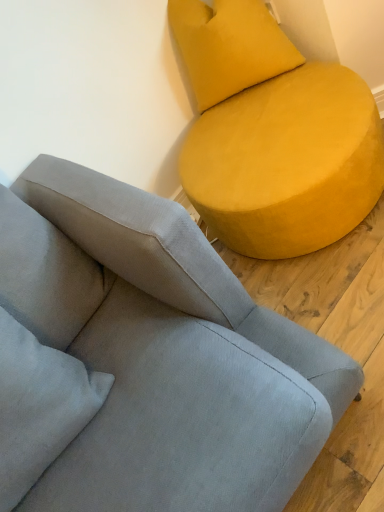
Question: Does point (379, 184) appear closer or farther from the camera than point (264, 30)?

Choices:
 (A) farther
 (B) closer

Answer: (B)

Question: In terms of size, does matte yellow ottoman at upper right, the 1th studio couch when ordered from right to left, appear bigger or smaller than velvet yellow pillow at upper right?

Choices:
 (A) small
 (B) big

Answer: (B)

Question: Estimate the real-world distances between objects in this image. Which object is closer to the matte yellow ottoman at upper right, acting as the 2th studio couch starting from the left?

Choices:
 (A) velvet yellow pillow at upper right
 (B) suede gray couch at upper right, which is counted as the 2th studio couch, starting from the right

Answer: (A)

Question: Considering the real-world distances, which object is closest to the matte yellow ottoman at upper right, acting as the 2th studio couch starting from the left?

Choices:
 (A) velvet yellow pillow at upper right
 (B) suede gray couch at upper right, which is counted as the 2th studio couch, starting from the right

Answer: (A)